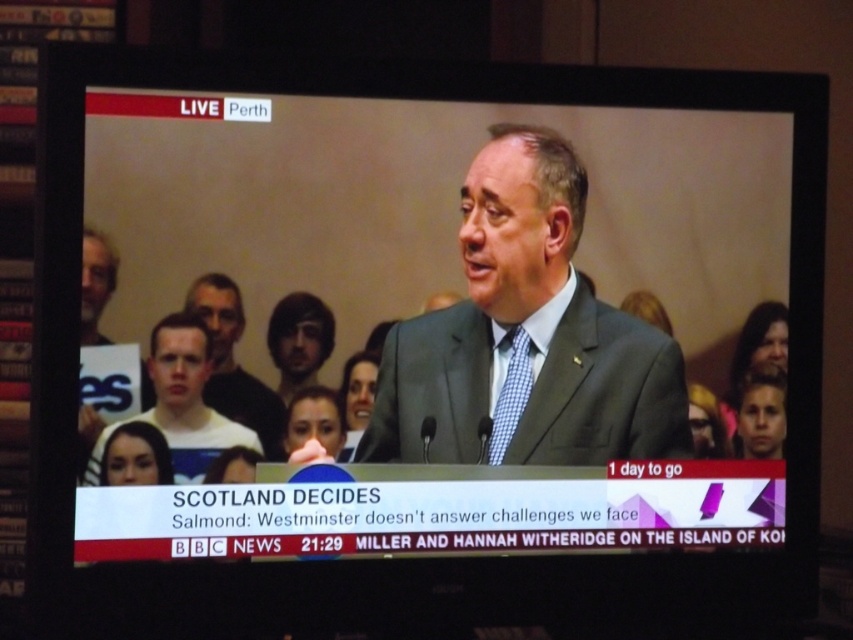
Between white shirt at lower left and checkered fabric tie at center, which one has less height?

checkered fabric tie at center

Describe the element at coordinates (189, 396) in the screenshot. Image resolution: width=853 pixels, height=640 pixels. I see `white shirt at lower left` at that location.

Between point (241, 444) and point (509, 422), which one is positioned behind?

Point (509, 422)

The width and height of the screenshot is (853, 640). What are the coordinates of `white shirt at lower left` in the screenshot? It's located at coord(189,396).

Between gray suit at center and checkered fabric tie at center, which one appears on the left side from the viewer's perspective?

From the viewer's perspective, checkered fabric tie at center appears more on the left side.

Measure the distance between point (x=579, y=385) and camera.

The distance of point (x=579, y=385) from camera is 5.12 feet.

Where is `gray suit at center`? The image size is (853, 640). gray suit at center is located at coordinates point(526,336).

Between light brown hair at center and checkered fabric tie at center, which one has more height?

light brown hair at center is taller.

Is point (219, 403) positioned behind point (514, 396)?

No, it is in front of (514, 396).

I want to click on light brown hair at center, so click(x=234, y=364).